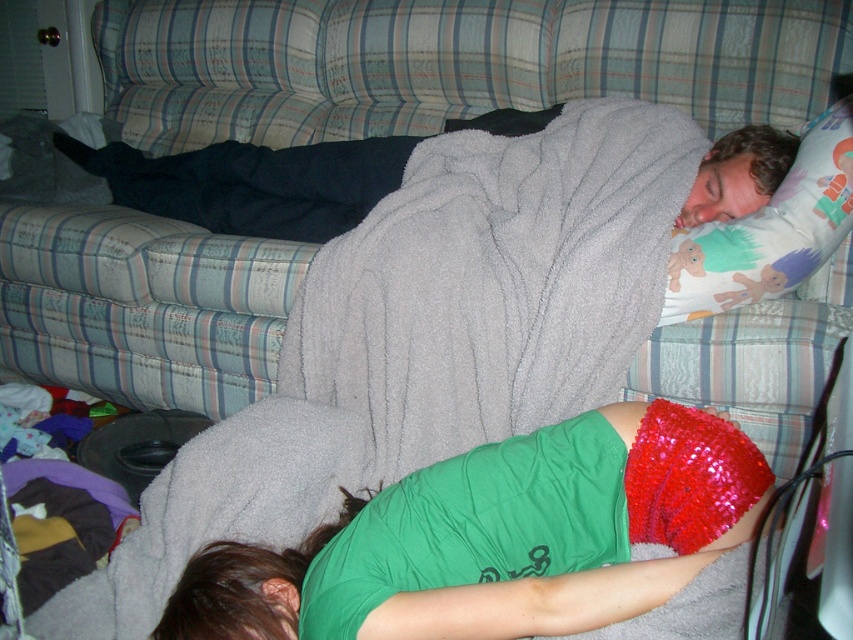
Is point (415, 486) more distant than point (717, 276)?

That is False.

Measure the distance between point (403, 632) and camera.

1.01 meters

Where is `green fabric shorts at lower center`? The height and width of the screenshot is (640, 853). green fabric shorts at lower center is located at coordinates (482, 529).